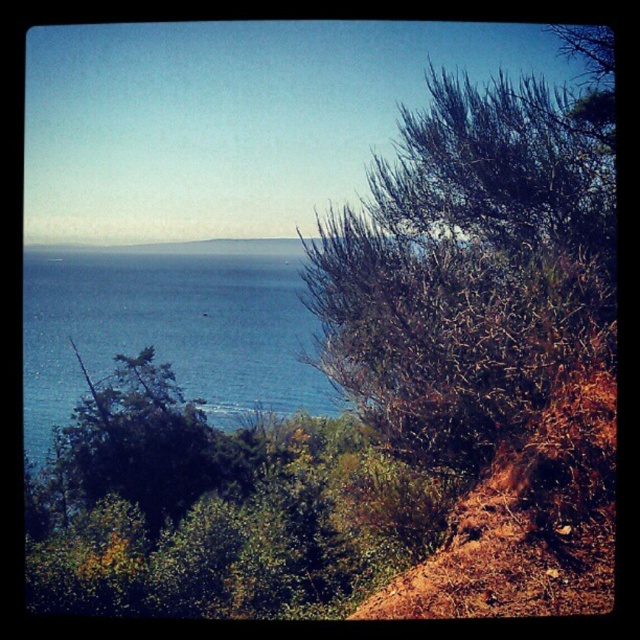
Question: Estimate the real-world distances between objects in this image. Which object is farther from the blue water at left?

Choices:
 (A) brown/dry bush at right
 (B) green leafy tree at left

Answer: (A)

Question: Can you confirm if brown/dry bush at right is thinner than blue water at left?

Choices:
 (A) yes
 (B) no

Answer: (A)

Question: Among these objects, which one is nearest to the camera?

Choices:
 (A) brown/dry bush at right
 (B) green leafy tree at left
 (C) blue water at left

Answer: (A)

Question: Among these points, which one is farthest from the camera?

Choices:
 (A) (444, 300)
 (B) (266, 259)
 (C) (157, 371)

Answer: (B)

Question: Can you confirm if brown/dry bush at right is positioned above blue water at left?

Choices:
 (A) no
 (B) yes

Answer: (B)

Question: Does blue water at left appear on the left side of green leafy tree at left?

Choices:
 (A) yes
 (B) no

Answer: (A)